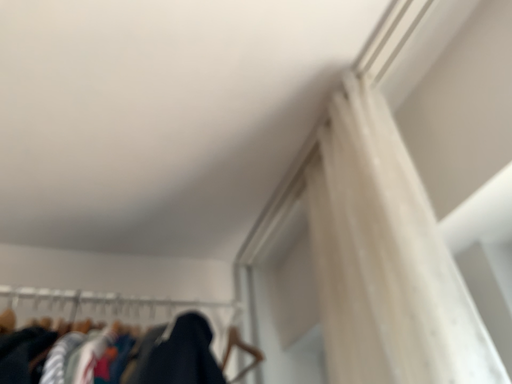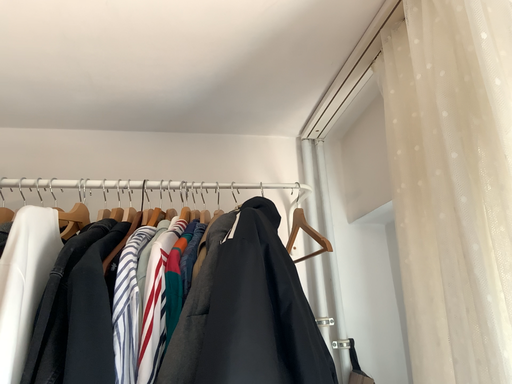
Question: Which way did the camera rotate in the video?

Choices:
 (A) rotated upward
 (B) rotated downward

Answer: (B)